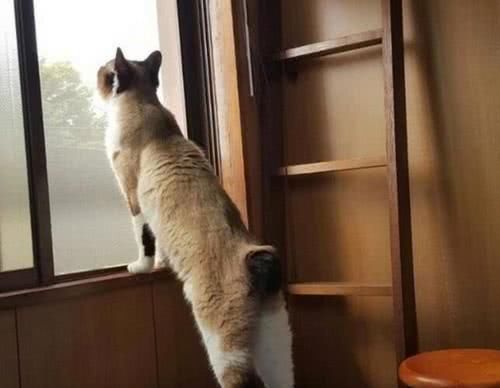
Image resolution: width=500 pixels, height=388 pixels. In order to click on white fur in this screenshot , I will do `click(228, 359)`, `click(277, 355)`, `click(169, 255)`, `click(146, 185)`, `click(139, 229)`, `click(115, 120)`, `click(97, 79)`, `click(116, 82)`.